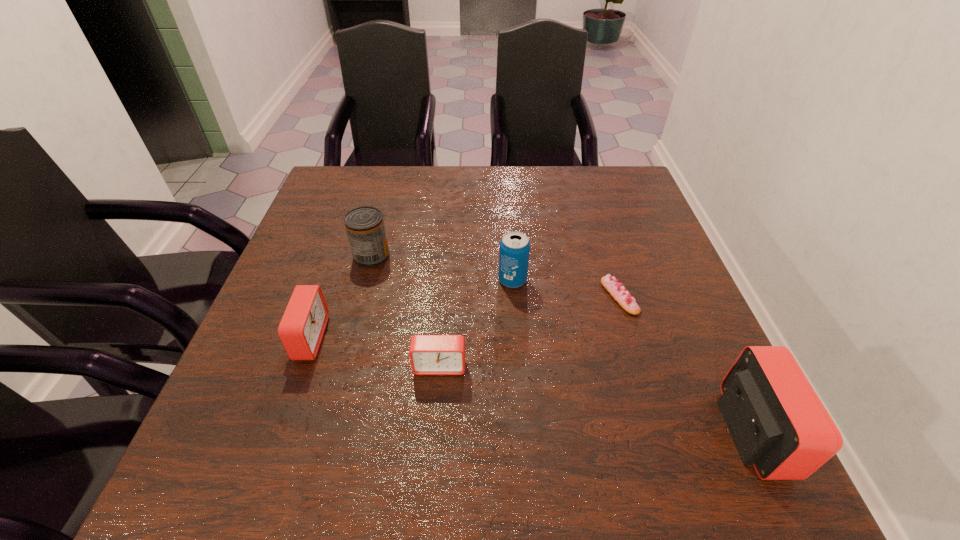
Identify the location of vacant spot for a new alarm_clock to ensure equal spacing. The image size is (960, 540). (586, 397).